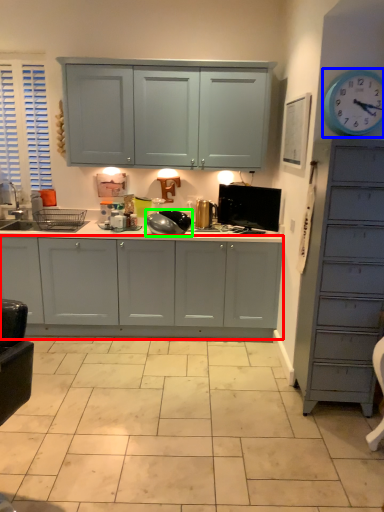
Question: Estimate the real-world distances between objects in this image. Which object is farther from cabinetry (highlighted by a red box), clock (highlighted by a blue box) or appliance (highlighted by a green box)?

Choices:
 (A) clock
 (B) appliance

Answer: (A)